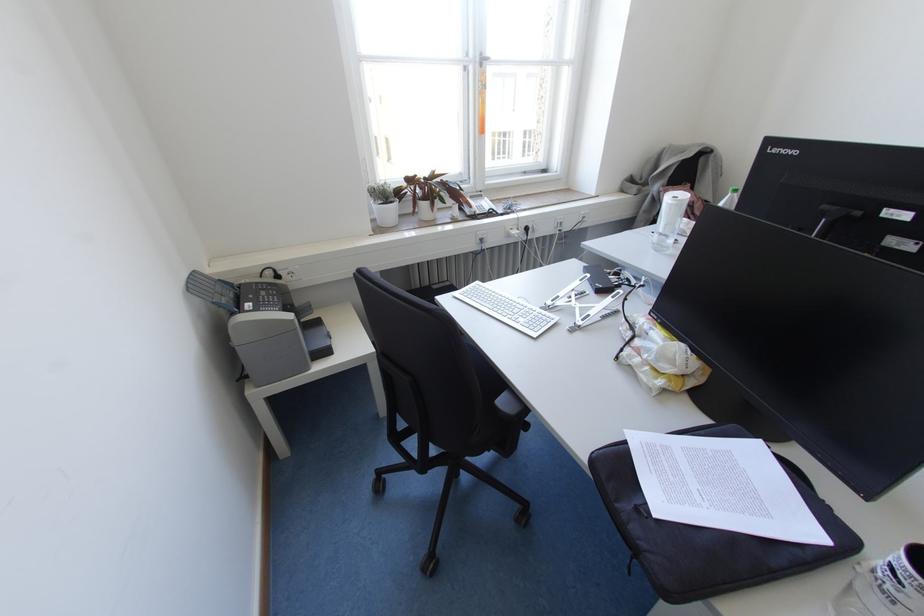
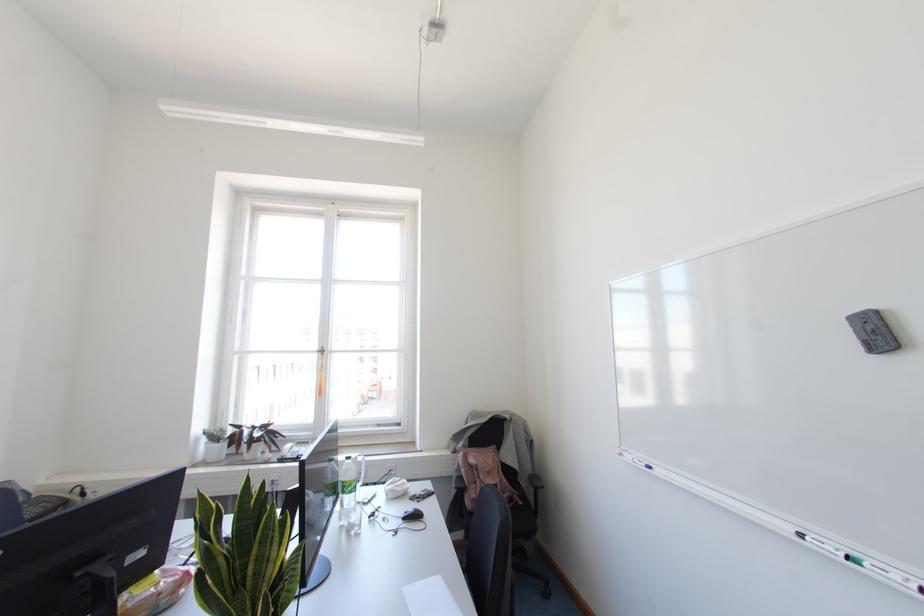
In the second image, find the point that corresponds to (x=390, y=187) in the first image.

(223, 431)